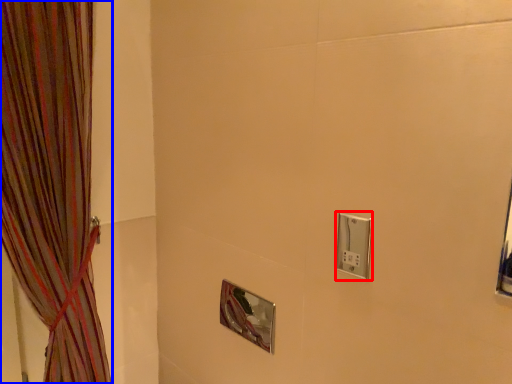
Question: Which of the following is the farthest to the observer, light switch (highlighted by a red box) or curtain (highlighted by a blue box)?

Choices:
 (A) light switch
 (B) curtain

Answer: (A)